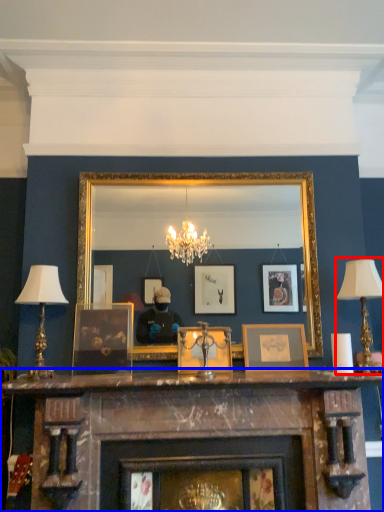
Question: Which of the following is the farthest to the observer, table lamp (highlighted by a red box) or fireplace (highlighted by a blue box)?

Choices:
 (A) table lamp
 (B) fireplace

Answer: (A)